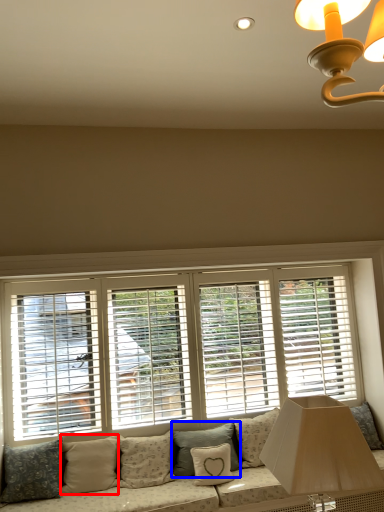
Question: Which of the following is the farthest to the observer, pillow (highlighted by a red box) or pillow (highlighted by a blue box)?

Choices:
 (A) pillow
 (B) pillow

Answer: (B)